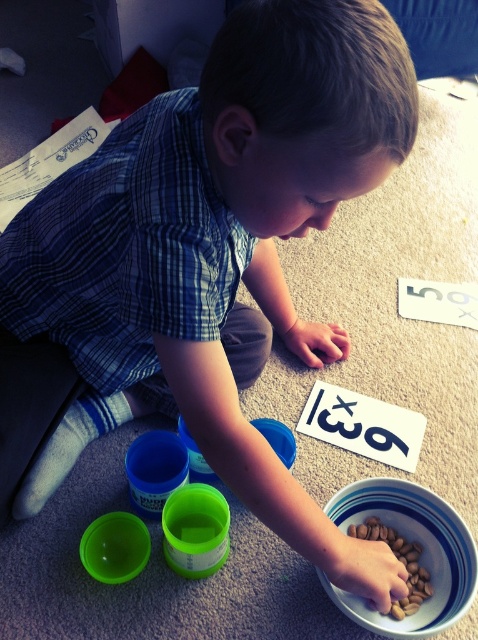
You are a toy delivery robot entering a playroom. You need to place a new toy in a container that is closer to you. Which object should you choose between the white glossy bowl at lower center and the brown matte nuts at lower center?

The white glossy bowl at lower center is closer to the viewer than the brown matte nuts at lower center, so you should choose the white glossy bowl at lower center to place the new toy.

The child is playing with items in the white glossy bowl at lower center and the brown matte nuts at lower center. Which object is positioned higher from the floor?

The white glossy bowl at lower center is located above the brown matte nuts at lower center, so it is positioned higher from the floor.